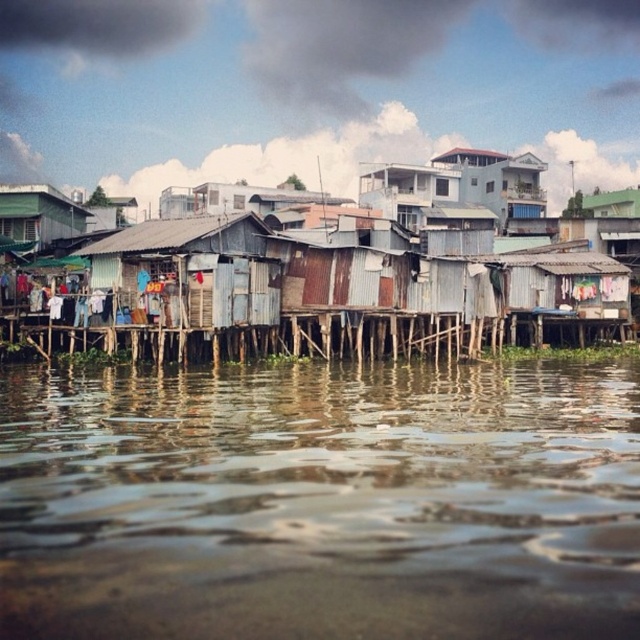
You are a delivery person trying to navigate between the rusty corrugated metal shacks at center and the rusty corrugated metal hut at center. Which structure is taller, and how might this affect your delivery route?

The rusty corrugated metal shacks at center are taller than the rusty corrugated metal hut at center. This height difference might require adjusting your delivery route to ensure clearance for any tall items you are carrying.

You are a photographer planning to capture the entire scene of the rusty corrugated metal shacks at center and the brown reflective water at lower center in a single shot. Based on their sizes, which object should you focus on first to ensure both are in frame?

The brown reflective water at lower center is smaller than the rusty corrugated metal shacks at center, so you should focus on the rusty corrugated metal shacks at center first to ensure both fit within the frame.

You are a visitor standing on the dock and want to take a photo of the rusty corrugated metal shacks at center and the green corrugated metal hut at left. Which one should you aim your camera towards first if you want to capture both in a single frame from your current position?

You should aim your camera towards the green corrugated metal hut at left first because the rusty corrugated metal shacks at center is positioned on the right side of it, so capturing the leftmost object first will allow both to be included in the frame.